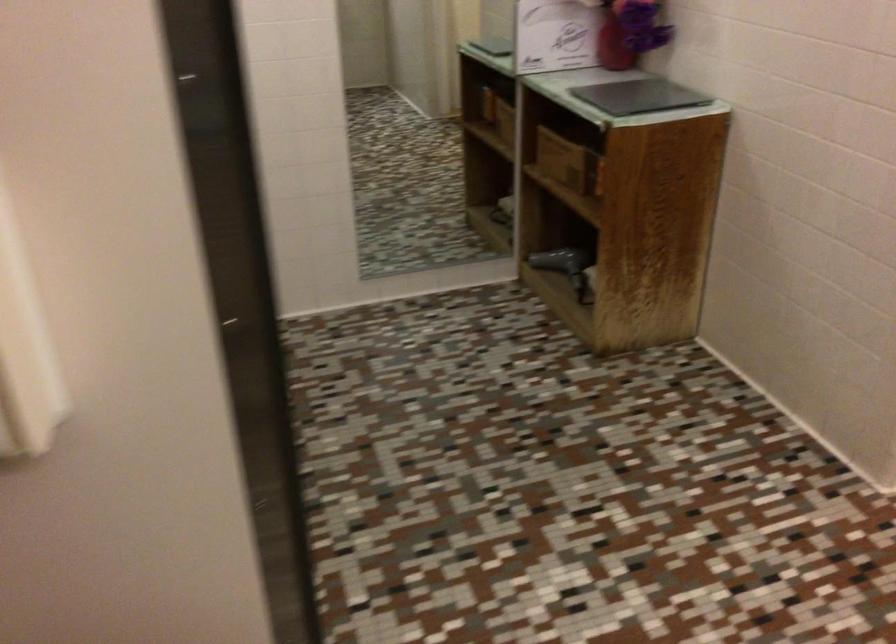
Which object does [564,266] point to?

It refers to a grey hair dryer.